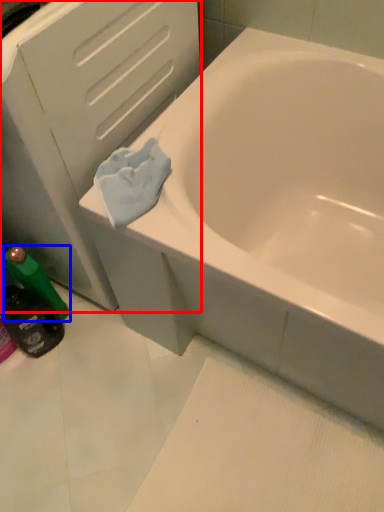
Question: Among these objects, which one is nearest to the camera, file cabinet (highlighted by a red box) or mouthwash (highlighted by a blue box)?

Choices:
 (A) file cabinet
 (B) mouthwash

Answer: (A)